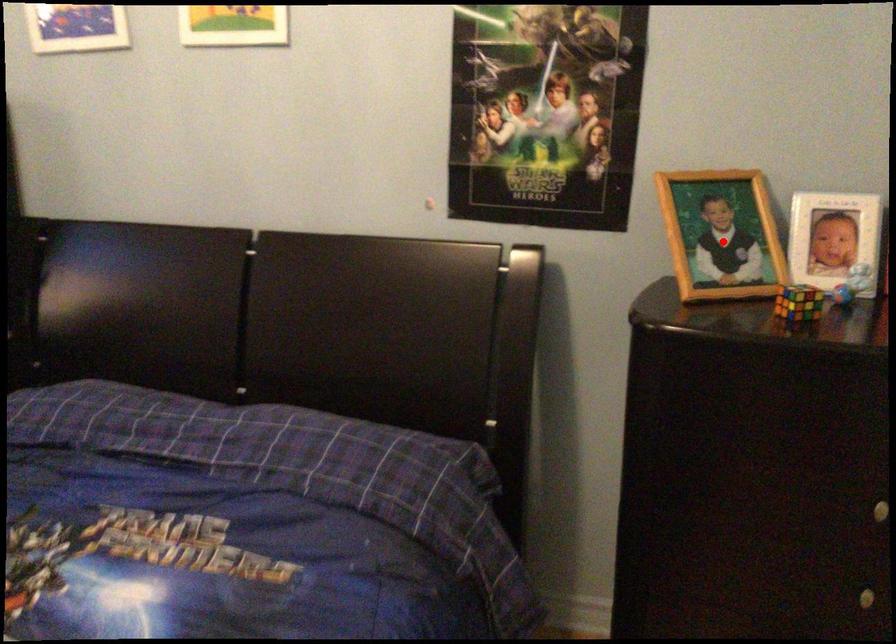
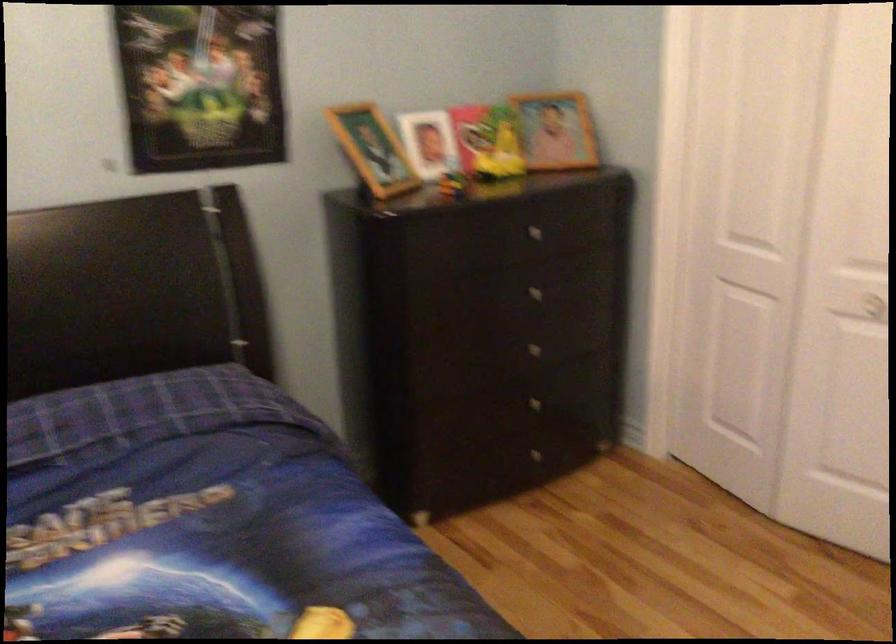
The point at the highlighted location is marked in the first image. Where is the corresponding point in the second image?

(373, 149)